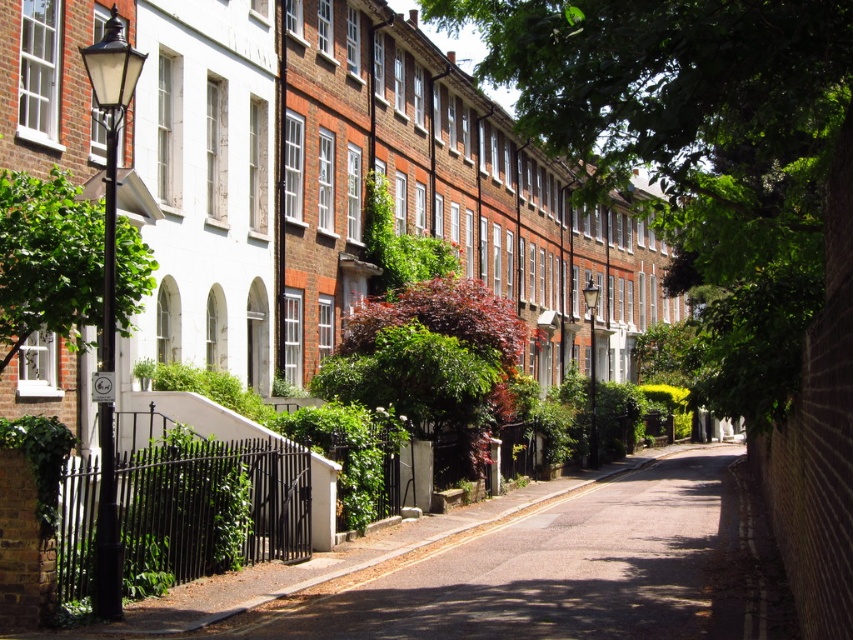
You are a city planner assessing the spacing between two green leafy trees in the image. Given that the minimum recommended distance between trees for proper growth is 30 feet, can you determine if the spacing between the green leafy tree at center and the green leafy tree at left meets this requirement?

The green leafy tree at center is 32.84 feet from the green leafy tree at left, which exceeds the minimum recommended distance of 30 feet, so the spacing meets the requirement.

Based on the photo, you are standing on the sidewalk looking at the urban street scene. There are two points marked on the image, one at coordinate point (764, 122) and the other at point (59, 289). Which point is closer to your current position?

Point (764, 122) is further to the viewer than point (59, 289), so the point closer to your current position is point (59, 289).

You are standing on the sidewalk on the left side of the street and want to walk to the green leafy tree at center. According to the coordinates provided, in which direction should you move relative to your current position?

The green leafy tree at center is located at coordinates point (701,150), so you should move towards the center of the street to reach it.